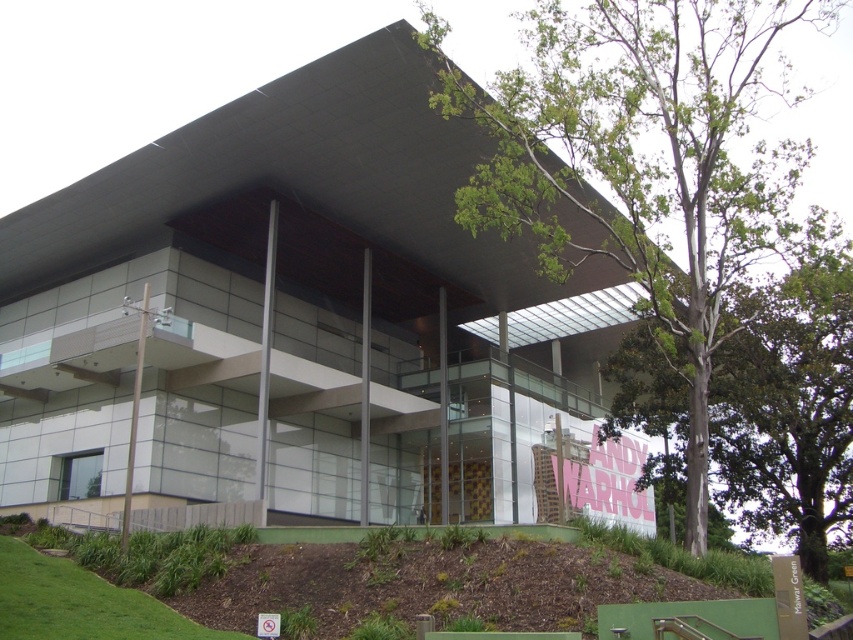
Question: Can you confirm if brown mulch at lower center is positioned below green leafy tree at right?

Choices:
 (A) yes
 (B) no

Answer: (A)

Question: Is green leafy tree at upper right to the right of green leafy tree at right from the viewer's perspective?

Choices:
 (A) yes
 (B) no

Answer: (A)

Question: Is green leafy tree at upper right wider than brown mulch at lower center?

Choices:
 (A) yes
 (B) no

Answer: (A)

Question: Which point is closer to the camera?

Choices:
 (A) (639, 401)
 (B) (523, 584)
 (C) (502, 212)

Answer: (B)

Question: Which of the following is the farthest from the observer?

Choices:
 (A) brown mulch at lower center
 (B) green leafy tree at right
 (C) green leafy tree at upper right

Answer: (B)

Question: Which point is closer to the camera taking this photo?

Choices:
 (A) (735, 317)
 (B) (599, 554)

Answer: (B)